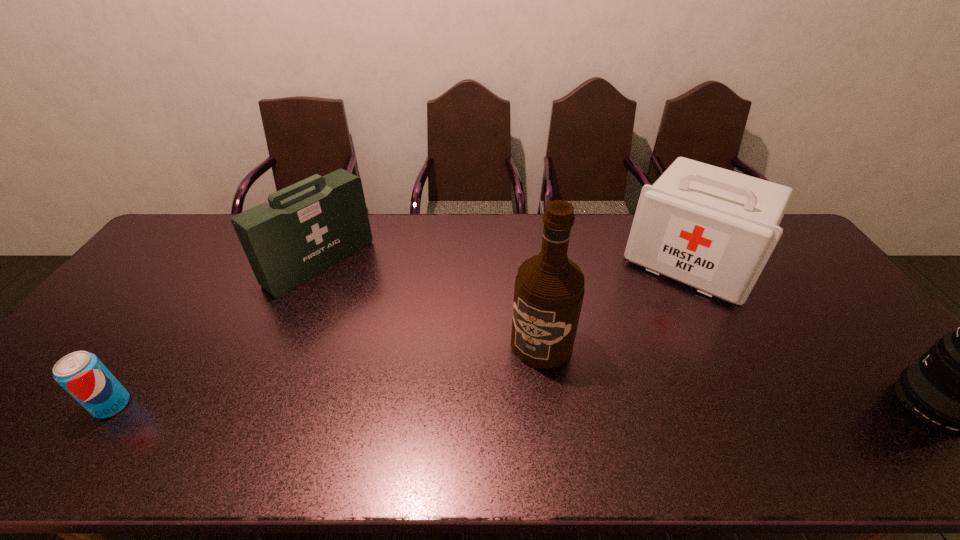
At what (x,y) coordinates should I click in order to perform the action: click on the leftmost object. Please return your answer as a coordinate pair (x, y). The image size is (960, 540). Looking at the image, I should click on (81, 374).

I want to click on soda can, so click(x=81, y=374).

Where is `the left first-aid kit`? This screenshot has width=960, height=540. the left first-aid kit is located at coordinates (307, 227).

This screenshot has height=540, width=960. I want to click on the right first-aid kit, so click(x=714, y=229).

Where is `the third object from right to left`? the third object from right to left is located at coordinates (549, 288).

This screenshot has height=540, width=960. In order to click on the tallest object in this screenshot , I will do `click(549, 288)`.

At what (x,y) coordinates should I click in order to perform the action: click on vacant space located 0.190m on the right of the shortest object. Please return your answer as a coordinate pair (x, y). Looking at the image, I should click on (209, 405).

Locate an element on the screen. vacant space located on the front-facing side of the left first-aid kit is located at coordinates (373, 305).

This screenshot has width=960, height=540. Identify the location of free region located on the front-facing side of the left first-aid kit. (419, 337).

Where is `vacant space located on the front-facing side of the left first-aid kit`? The image size is (960, 540). vacant space located on the front-facing side of the left first-aid kit is located at coordinates (424, 341).